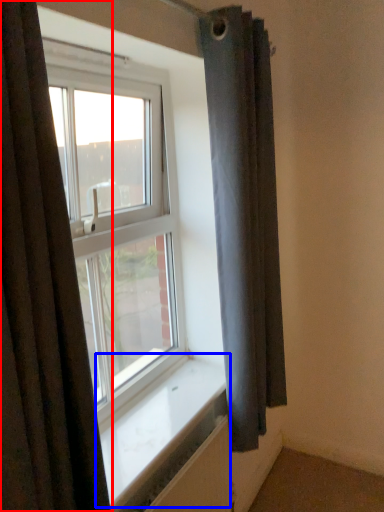
Question: Which of the following is the closest to the observer, curtain (highlighted by a red box) or window sill (highlighted by a blue box)?

Choices:
 (A) curtain
 (B) window sill

Answer: (A)